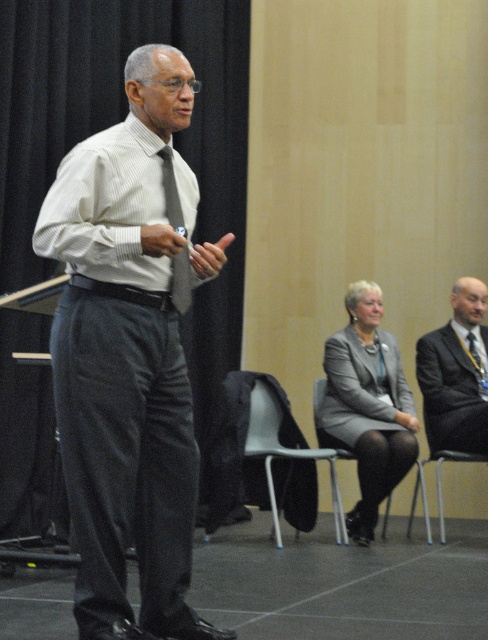
Question: Is metallic gray chair at center below metallic gray chair at lower center?

Choices:
 (A) no
 (B) yes

Answer: (A)

Question: Which point is closer to the camera taking this photo?

Choices:
 (A) (429, 528)
 (B) (185, 244)
 (C) (82, 144)
 (D) (432, 456)

Answer: (C)

Question: Is matte gray shirt at center closer to the viewer compared to metallic gray chair at lower center?

Choices:
 (A) yes
 (B) no

Answer: (A)

Question: Estimate the real-world distances between objects in this image. Which object is closer to the metallic gray chair at lower center?

Choices:
 (A) gray fabric tie at center
 (B) matte gray shirt at center
 (C) dark gray suit at right

Answer: (C)

Question: Which object is farther from the camera taking this photo?

Choices:
 (A) dark gray suit at right
 (B) white striped shirt at center
 (C) matte gray shirt at center
 (D) metallic gray chair at lower center

Answer: (D)

Question: Can you confirm if matte gray shirt at center is bigger than white striped shirt at center?

Choices:
 (A) yes
 (B) no

Answer: (A)